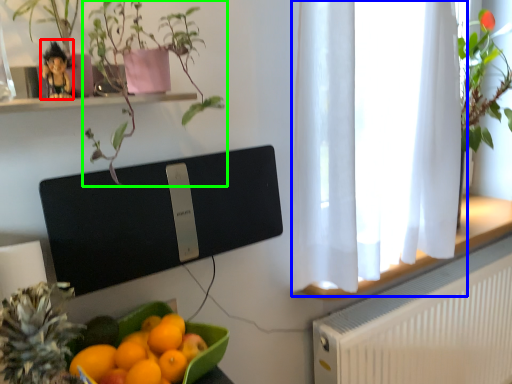
Question: Which object is positioned closest to toy (highlighted by a red box)? Select from window frame (highlighted by a blue box) and houseplant (highlighted by a green box).

Choices:
 (A) window frame
 (B) houseplant

Answer: (B)